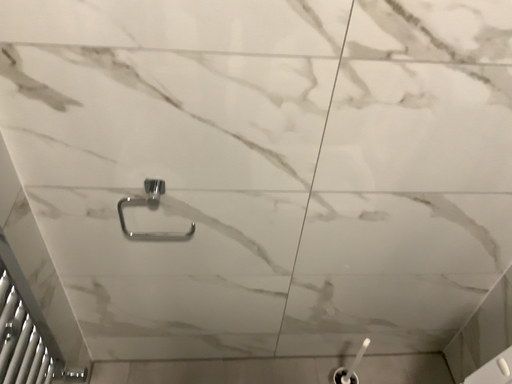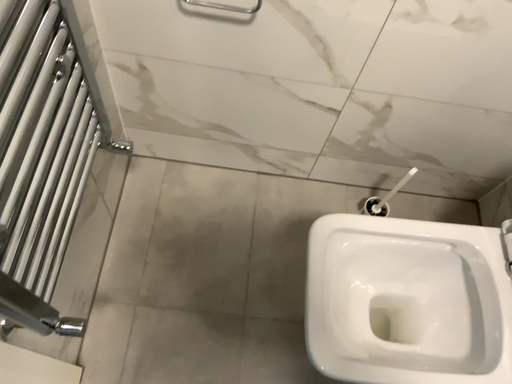
Question: Which way did the camera rotate in the video?

Choices:
 (A) rotated upward
 (B) rotated downward

Answer: (B)